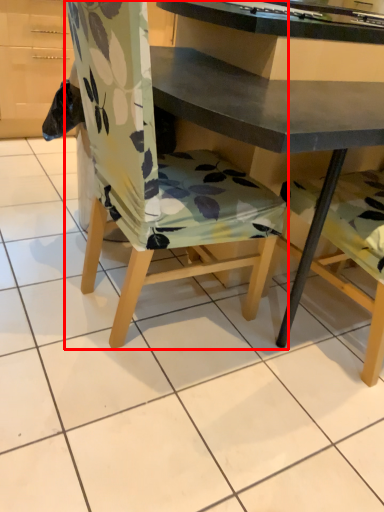
Question: From the image's perspective, considering the relative positions of chair (annotated by the red box) and desk in the image provided, where is chair (annotated by the red box) located with respect to the staircase?

Choices:
 (A) below
 (B) above

Answer: (B)